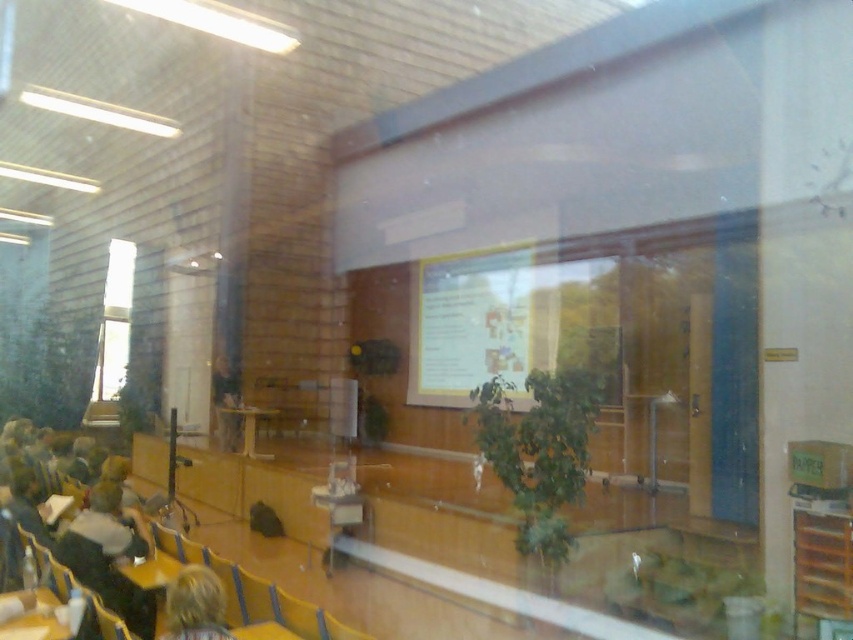
Does yellow paper at center have a larger size compared to matte black laptop at center?

Yes, yellow paper at center is bigger than matte black laptop at center.

Is point (596, 317) positioned after point (219, 420)?

No, (596, 317) is in front of (219, 420).

Does point (599, 333) come behind point (225, 412)?

No.

Locate an element on the screen. yellow paper at center is located at coordinates (503, 321).

Is blonde hair at lower left smaller than light brown leather jacket at lower left?

Indeed, blonde hair at lower left has a smaller size compared to light brown leather jacket at lower left.

This screenshot has width=853, height=640. What do you see at coordinates (195, 605) in the screenshot?
I see `blonde hair at lower left` at bounding box center [195, 605].

Does point (198, 577) come closer to viewer compared to point (107, 540)?

Yes, it is.

Find the location of a particular element. blonde hair at lower left is located at coordinates (195, 605).

Can you confirm if light brown leather jacket at lower left is taller than matte black laptop at center?

No, light brown leather jacket at lower left is not taller than matte black laptop at center.

Between light brown leather jacket at lower left and matte black laptop at center, which one is positioned lower?

matte black laptop at center is below.

Looking at this image, who is more distant from viewer, [83,536] or [230,448]?

Point [230,448]

Find the location of a particular element. light brown leather jacket at lower left is located at coordinates (112, 524).